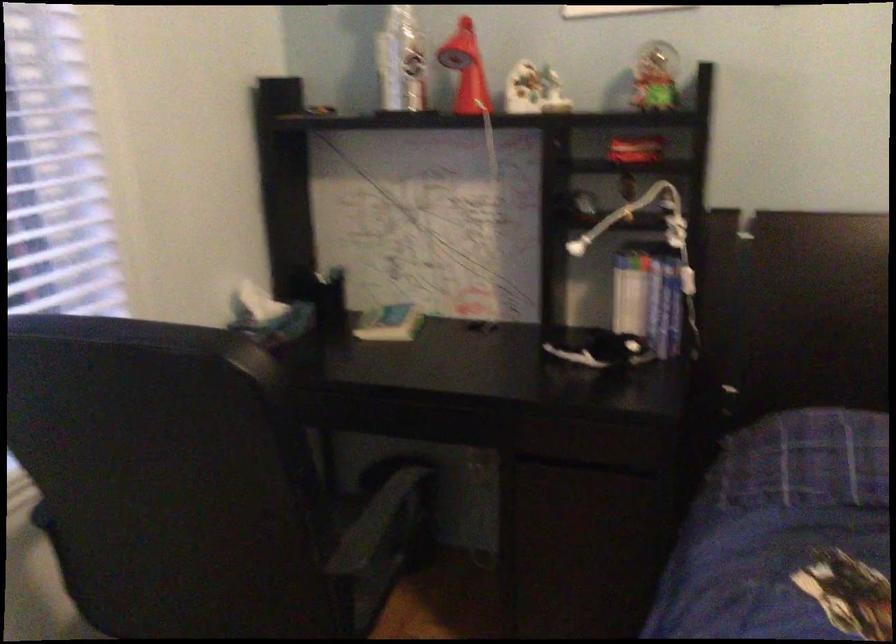
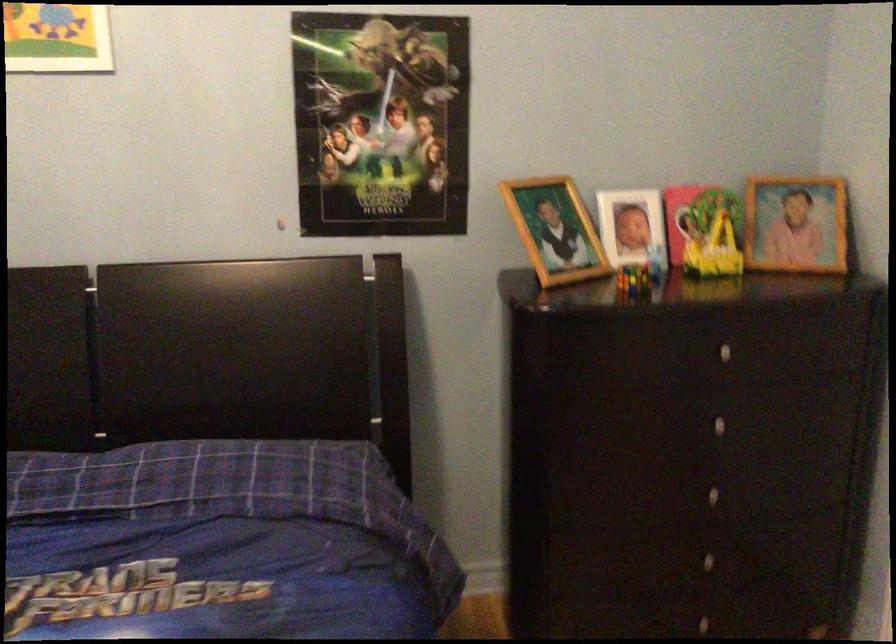
What movement of the cameraman would produce the second image?

The cameraman walked toward right, backward.